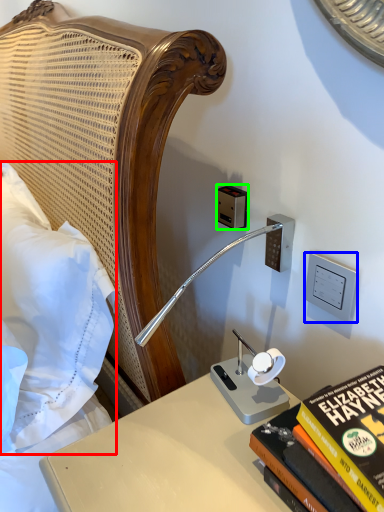
Question: Based on their relative distances, which object is nearer to pillow (highlighted by a red box)? Choose from electric outlet (highlighted by a blue box) and electric outlet (highlighted by a green box).

Choices:
 (A) electric outlet
 (B) electric outlet

Answer: (B)